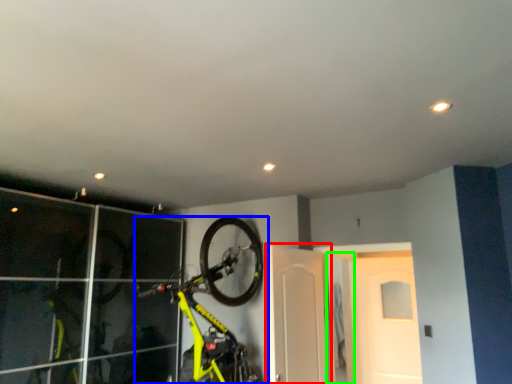
Question: Considering the real-world distances, which object is closest to door (highlighted by a red box)? bicycle (highlighted by a blue box) or door (highlighted by a green box).

Choices:
 (A) bicycle
 (B) door

Answer: (A)